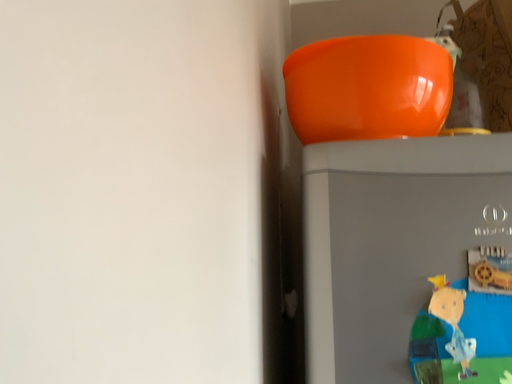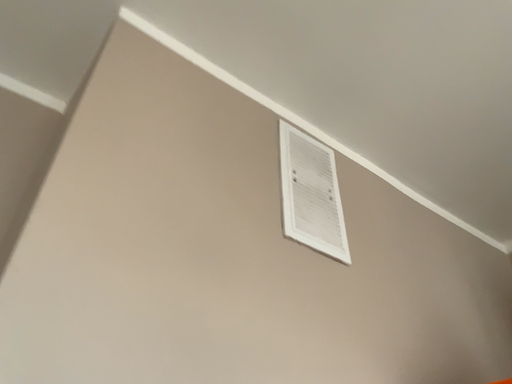
Question: How did the camera likely rotate when shooting the video?

Choices:
 (A) rotated downward
 (B) rotated upward

Answer: (B)